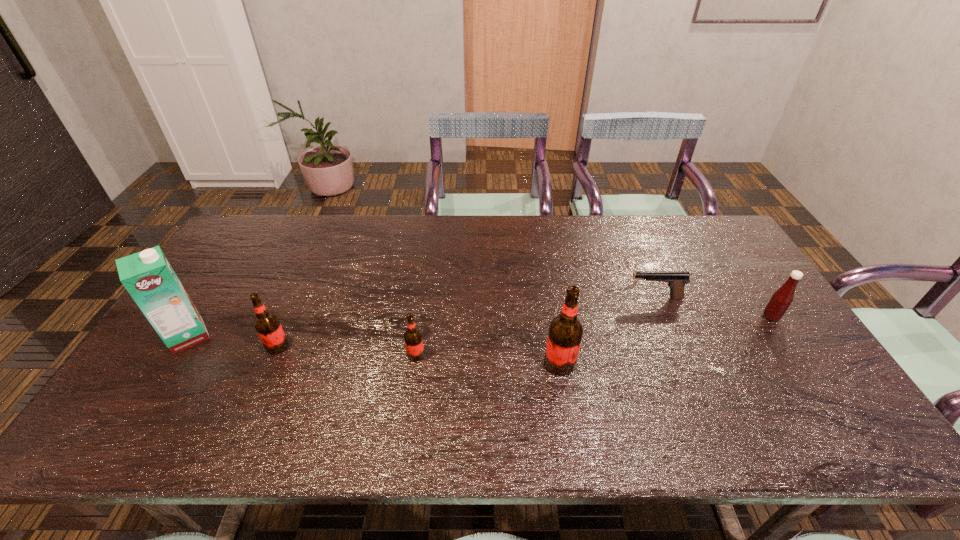
Where is `free space for a new root beer on the right`? The height and width of the screenshot is (540, 960). free space for a new root beer on the right is located at coordinates (709, 373).